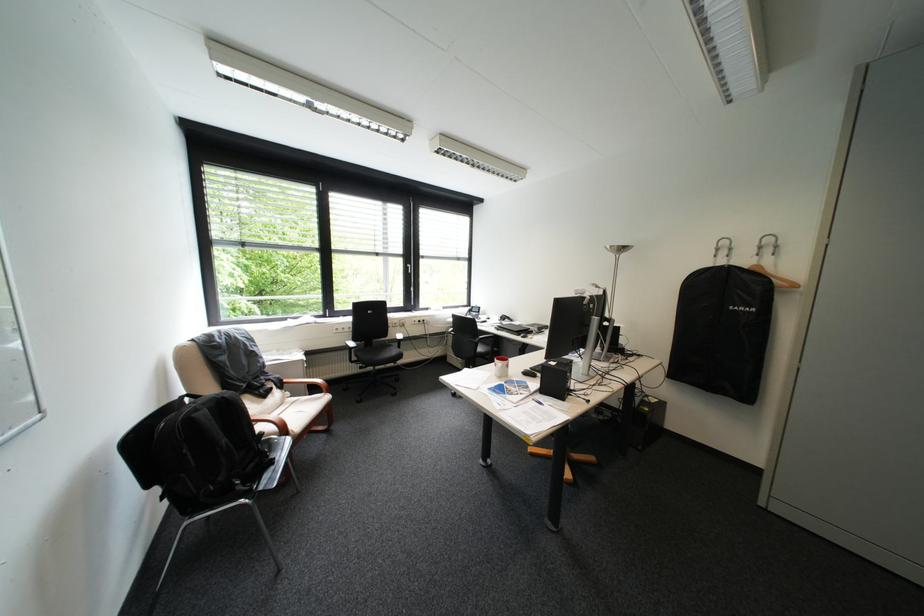
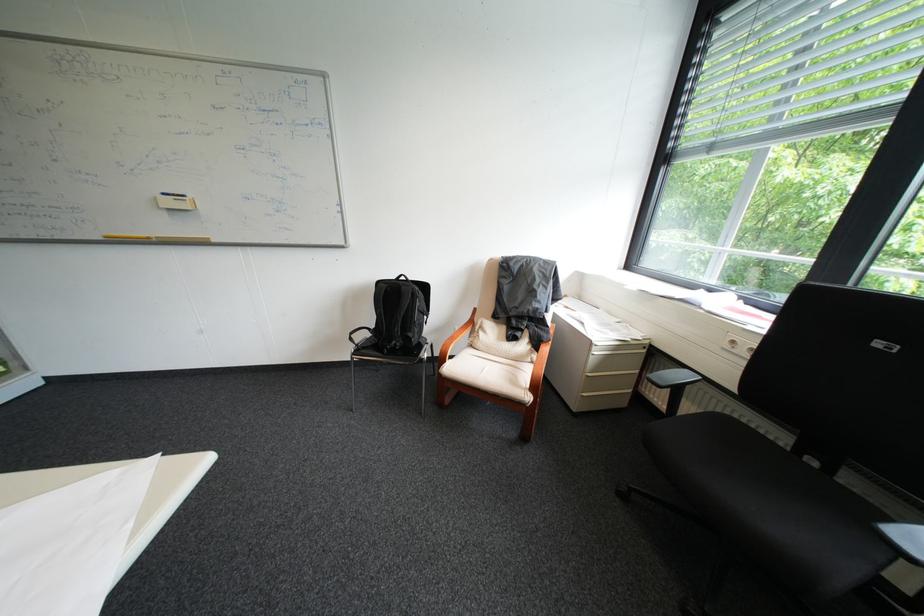
The point at [236,398] is marked in the first image. Where is the corresponding point in the second image?

(415, 288)